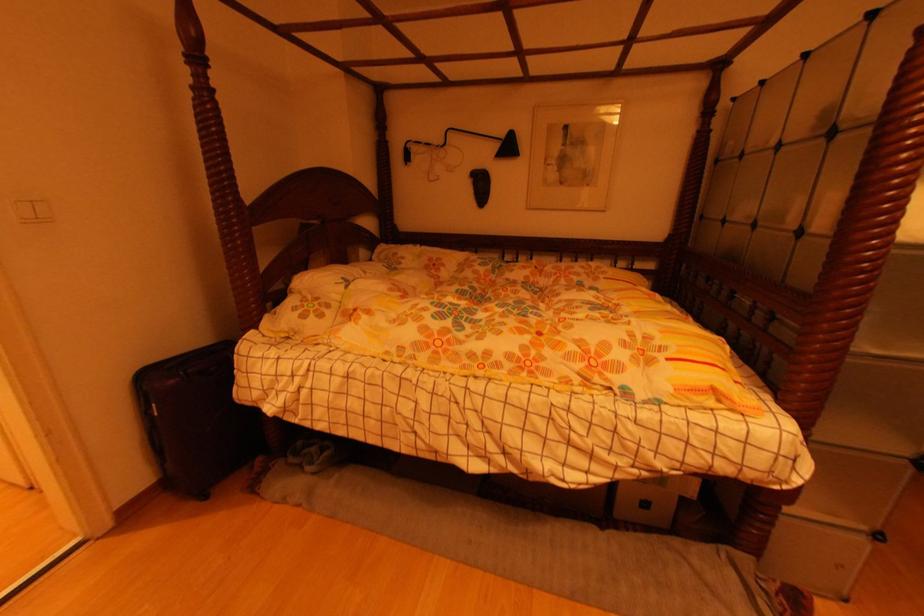
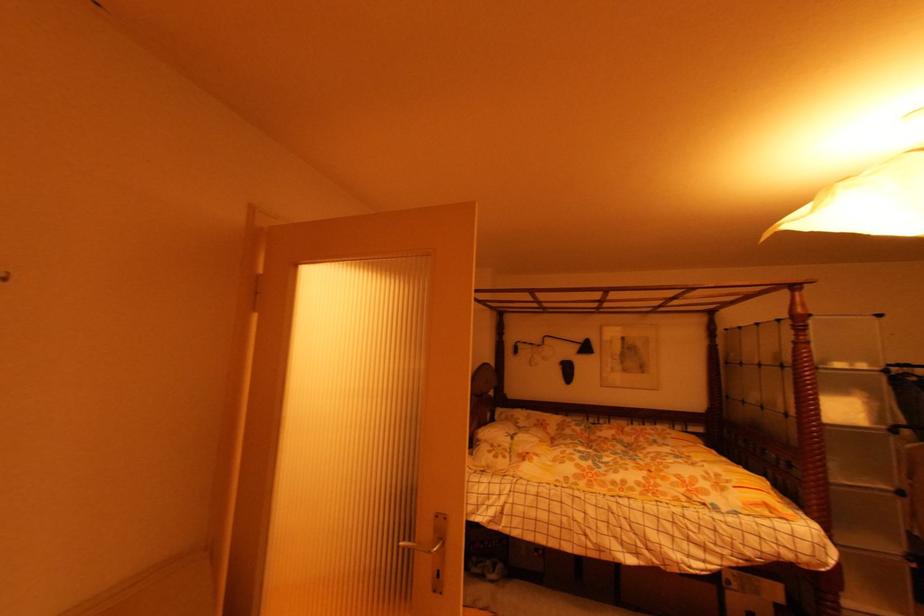
In a continuous first-person perspective shot, in which direction is the camera moving?

The cameraman walked toward left, backward.